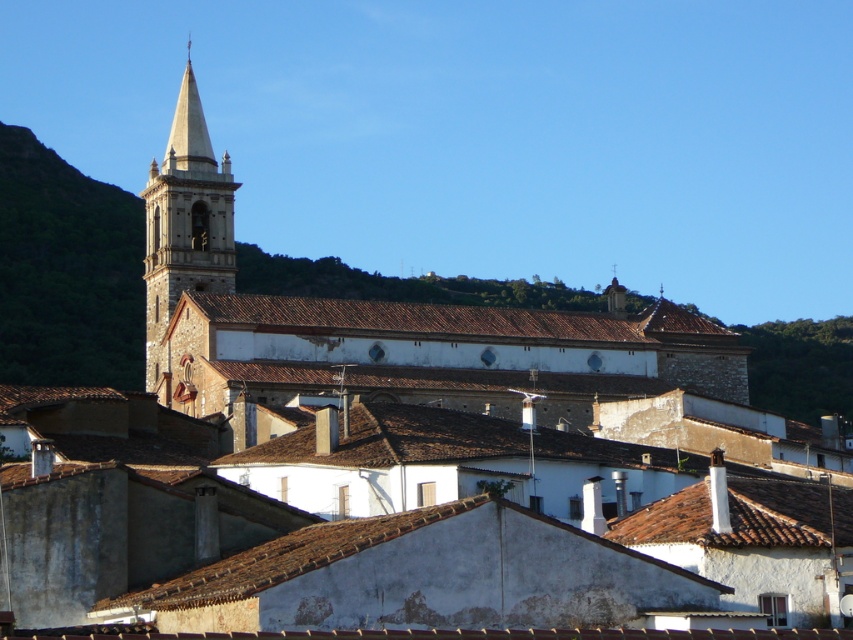
Can you confirm if brown stone church at center is thinner than stone steeple at upper left?

Incorrect, brown stone church at center's width is not less than stone steeple at upper left's.

Between point (212, 412) and point (202, 131), which one is positioned behind?

Positioned behind is point (202, 131).

Is point (184, 122) less distant than point (229, 164)?

No, it is not.

You are a GUI agent. You are given a task and a screenshot of the screen. Output one action in this format:
    pyautogui.click(x=<x>, y=<y>)
    Task: Click on the brown stone church at center
    The height and width of the screenshot is (640, 853).
    Given the screenshot: What is the action you would take?
    pyautogui.click(x=381, y=324)